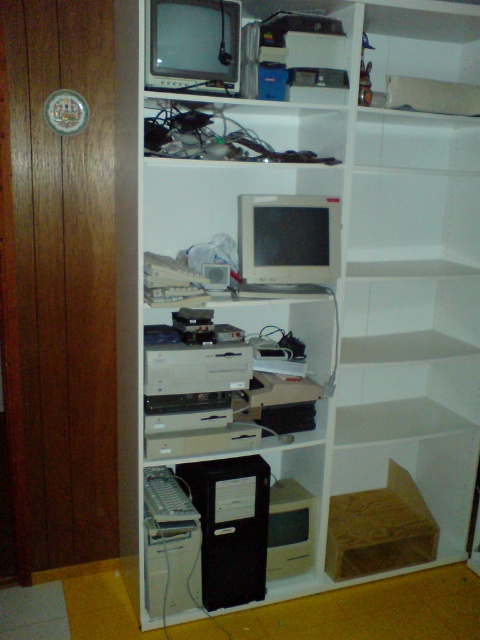
Question: Is the position of black plastic computer tower at center more distant than that of matte gray monitor at center?

Choices:
 (A) yes
 (B) no

Answer: (A)

Question: Can you confirm if black plastic computer tower at center is bigger than matte gray monitor at center?

Choices:
 (A) no
 (B) yes

Answer: (B)

Question: Which of the following is the farthest from the observer?

Choices:
 (A) tap(459, 364)
 (B) tap(178, 476)
 (C) tap(252, 202)

Answer: (A)

Question: Is white matte bookshelf at center below matte gray monitor at center?

Choices:
 (A) no
 (B) yes

Answer: (B)

Question: Estimate the real-world distances between objects in this image. Which object is closer to the matte gray monitor at center?

Choices:
 (A) black plastic computer tower at center
 (B) white matte bookshelf at center

Answer: (B)

Question: Which point is closer to the camera?

Choices:
 (A) (196, 589)
 (B) (333, 262)
 (C) (216, 529)

Answer: (C)